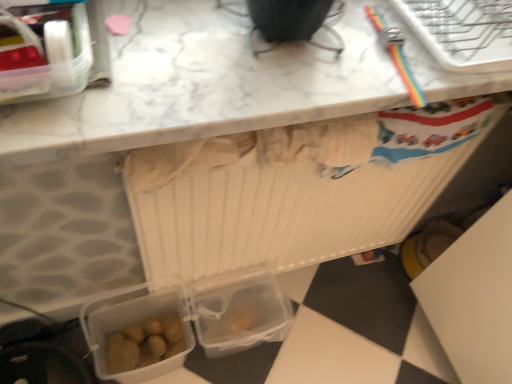
Question: In terms of size, does translucent plastic lunch box at lower left, the first lunch box positioned from the bottom, appear bigger or smaller than transparent plastic lunch box at lower center, positioned as the 2th lunch box in bottom-to-top order?

Choices:
 (A) small
 (B) big

Answer: (A)

Question: Considering the positions of translucent plastic lunch box at lower left, which is counted as the third lunch box, starting from the top, and transparent plastic lunch box at lower center, which is the second lunch box in top-to-bottom order, in the image, is translucent plastic lunch box at lower left, which is counted as the third lunch box, starting from the top, taller or shorter than transparent plastic lunch box at lower center, which is the second lunch box in top-to-bottom order,?

Choices:
 (A) short
 (B) tall

Answer: (B)

Question: Considering the real-world distances, which object is farthest from the white marble countertop at upper center?

Choices:
 (A) rainbow plastic bracelet at upper right
 (B) transparent plastic lunch box at lower center, which is the second lunch box in top-to-bottom order
 (C) translucent plastic lunch box at lower left, the 2th lunch box positioned from the front
 (D) translucent plastic lunch box at upper left, the 3th lunch box ordered from the bottom

Answer: (C)

Question: Based on their relative distances, which object is farther from the white marble countertop at upper center?

Choices:
 (A) transparent plastic lunch box at lower center, arranged as the first lunch box when viewed from the back
 (B) translucent plastic lunch box at upper left, the 3th lunch box ordered from the bottom
 (C) rainbow plastic bracelet at upper right
 (D) translucent plastic lunch box at lower left, the 2th lunch box positioned from the front

Answer: (D)